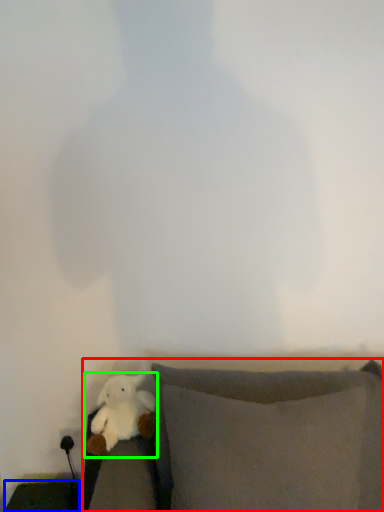
Question: Which is farther away from furniture (highlighted by a red box)? furniture (highlighted by a blue box) or toy (highlighted by a green box)?

Choices:
 (A) furniture
 (B) toy

Answer: (A)